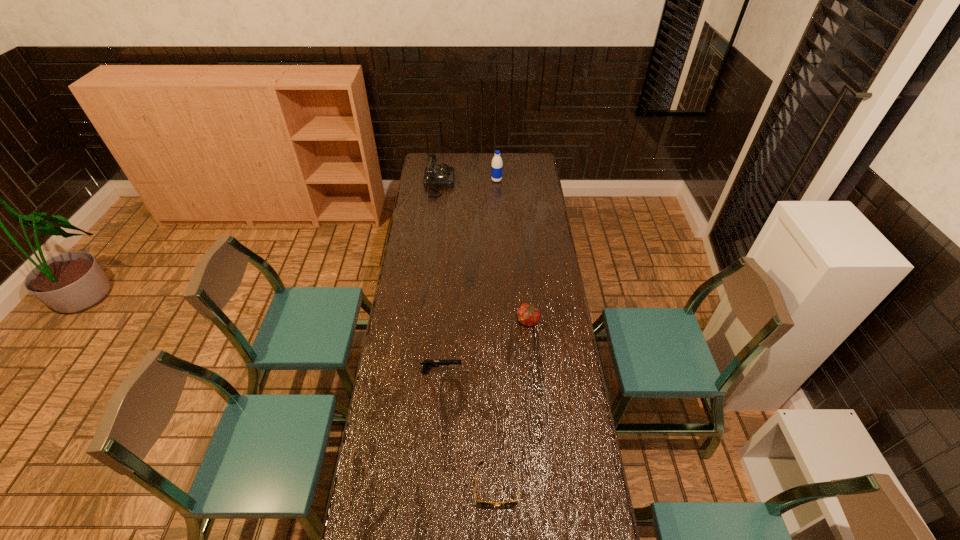
This screenshot has height=540, width=960. I want to click on vacant point located on the front of the rightmost object, so click(x=533, y=363).

The height and width of the screenshot is (540, 960). Find the location of `vacant space positioned 0.060m on the front-facing side of the sunglasses`. vacant space positioned 0.060m on the front-facing side of the sunglasses is located at coordinates (497, 531).

Identify the location of object located in the far edge section of the desktop. [435, 176].

What are the coordinates of `telephone that is at the left edge` in the screenshot? It's located at (435, 176).

Where is `gun present at the left edge`? The height and width of the screenshot is (540, 960). gun present at the left edge is located at coordinates tap(427, 364).

I want to click on object located at the right edge, so click(x=529, y=315).

Find the location of `object that is positioned at the far left corner`. object that is positioned at the far left corner is located at coordinates (435, 176).

The height and width of the screenshot is (540, 960). Find the location of `vacant space at the far edge`. vacant space at the far edge is located at coordinates (456, 167).

In the image, there is a desktop. Where is `free region at the left edge`? free region at the left edge is located at coordinates (372, 463).

I want to click on free spot at the right edge of the desktop, so click(x=537, y=199).